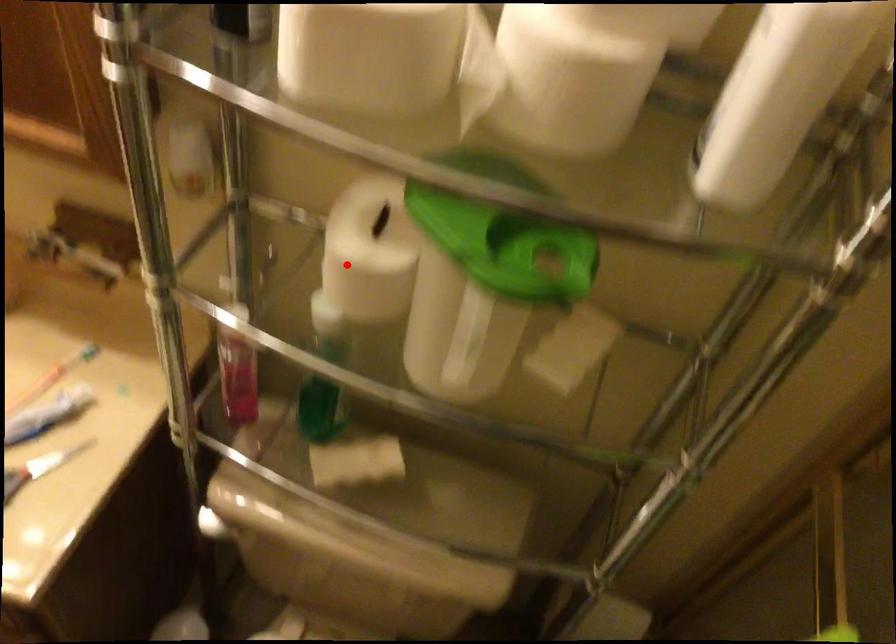
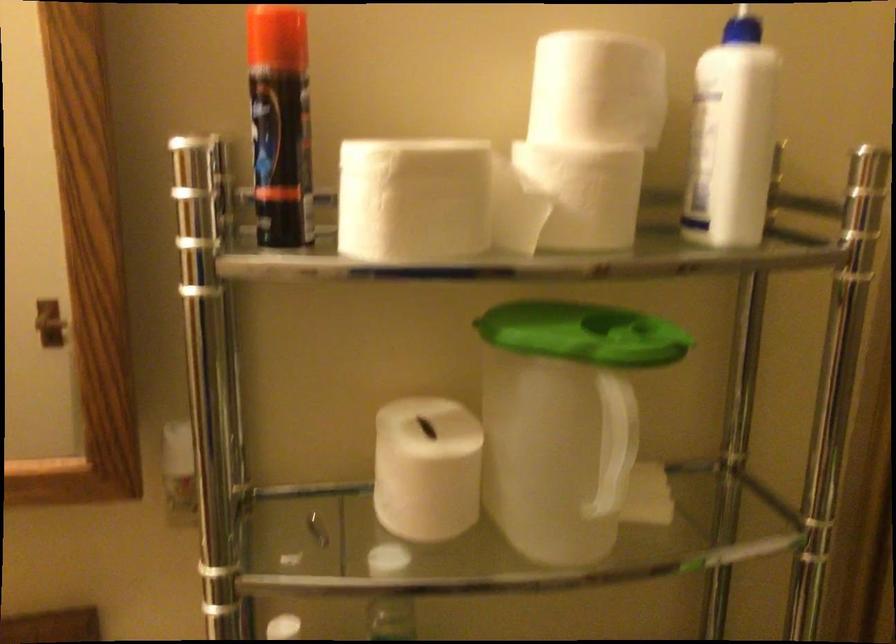
In the second image, find the point that corresponds to the highlighted location in the first image.

(426, 469)